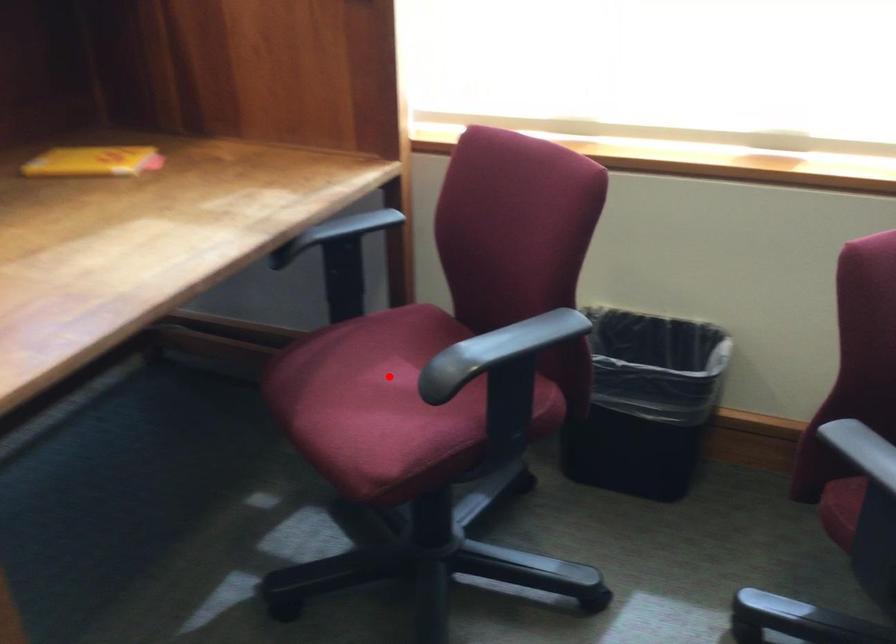
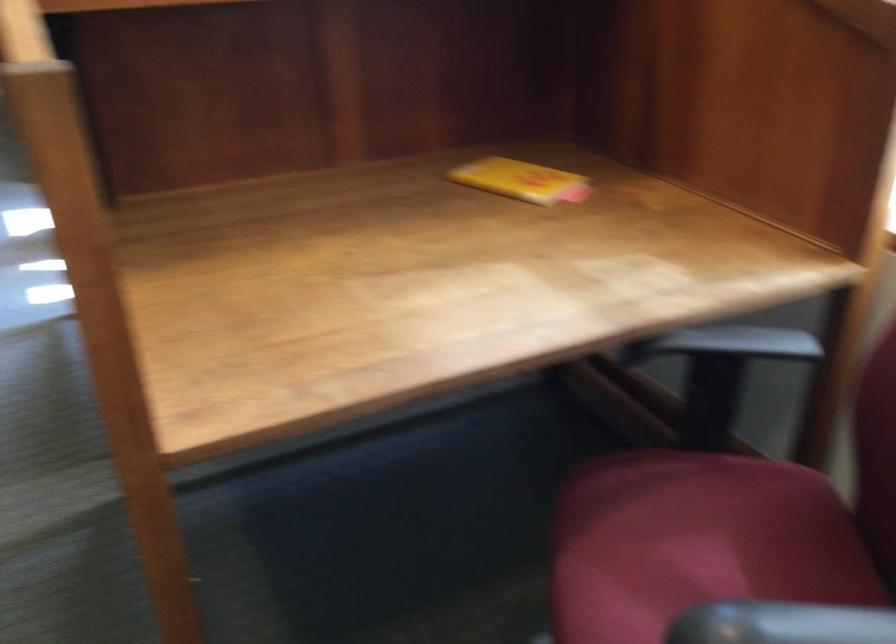
Question: I am providing you with two images of the same scene from different viewpoints. In image1, a red point is highlighted. Considering the same 3D point in image2, which of the following is correct?

Choices:
 (A) It is closer
 (B) It is farther

Answer: (A)